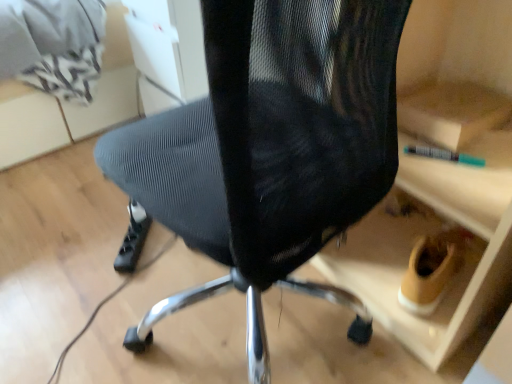
Question: From the image's perspective, does black mesh chair at center appear higher than black plastic power strip at lower left?

Choices:
 (A) yes
 (B) no

Answer: (A)

Question: Does black mesh chair at center have a smaller size compared to black plastic power strip at lower left?

Choices:
 (A) no
 (B) yes

Answer: (A)

Question: Is black mesh chair at center further to the viewer compared to black plastic power strip at lower left?

Choices:
 (A) no
 (B) yes

Answer: (A)

Question: Considering the relative sizes of black mesh chair at center and black plastic power strip at lower left in the image provided, is black mesh chair at center shorter than black plastic power strip at lower left?

Choices:
 (A) no
 (B) yes

Answer: (A)

Question: From a real-world perspective, does black mesh chair at center stand above black plastic power strip at lower left?

Choices:
 (A) no
 (B) yes

Answer: (B)

Question: Choose the correct answer: Is black plastic power strip at lower left inside black mesh chair at center or outside it?

Choices:
 (A) outside
 (B) inside

Answer: (A)

Question: In terms of height, does black plastic power strip at lower left look taller or shorter compared to black mesh chair at center?

Choices:
 (A) short
 (B) tall

Answer: (A)

Question: In terms of size, does black plastic power strip at lower left appear bigger or smaller than black mesh chair at center?

Choices:
 (A) small
 (B) big

Answer: (A)

Question: In terms of width, does black plastic power strip at lower left look wider or thinner when compared to black mesh chair at center?

Choices:
 (A) wide
 (B) thin

Answer: (B)

Question: From the image's perspective, is black mesh chair at center located above or below matte gray mesh chair at upper center?

Choices:
 (A) above
 (B) below

Answer: (B)

Question: Would you say black mesh chair at center is inside or outside matte gray mesh chair at upper center?

Choices:
 (A) outside
 (B) inside

Answer: (A)

Question: Is black mesh chair at center taller or shorter than matte gray mesh chair at upper center?

Choices:
 (A) tall
 (B) short

Answer: (A)

Question: Considering the positions of black mesh chair at center and matte gray mesh chair at upper center in the image, is black mesh chair at center wider or thinner than matte gray mesh chair at upper center?

Choices:
 (A) wide
 (B) thin

Answer: (B)

Question: Choose the correct answer: Is black mesh chair at center inside black plastic power strip at lower left or outside it?

Choices:
 (A) outside
 (B) inside

Answer: (A)

Question: From the image's perspective, is black mesh chair at center positioned above or below black plastic power strip at lower left?

Choices:
 (A) above
 (B) below

Answer: (A)